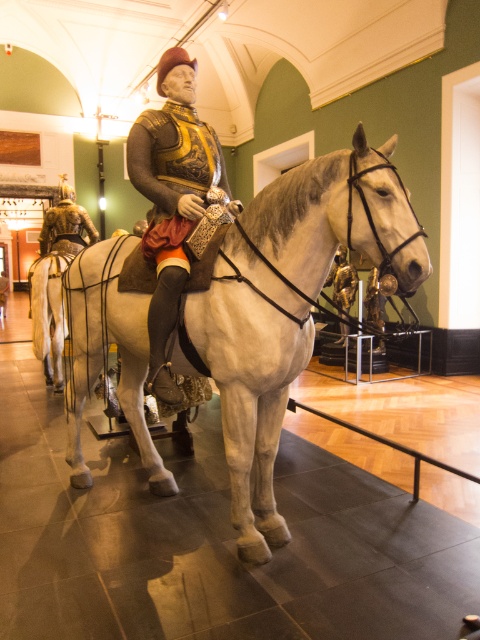
Question: Which point is farther from the camera taking this photo?

Choices:
 (A) (95, 312)
 (B) (171, 291)

Answer: (A)

Question: Observing the image, what is the correct spatial positioning of white glossy horse at center in reference to matte gold armor at center?

Choices:
 (A) above
 (B) below

Answer: (B)

Question: Is white glossy horse at center in front of matte gold armor at center?

Choices:
 (A) yes
 (B) no

Answer: (A)

Question: Is white glossy horse at center positioned behind matte gold armor at center?

Choices:
 (A) no
 (B) yes

Answer: (A)

Question: Among these points, which one is nearest to the camera?

Choices:
 (A) (396, 205)
 (B) (166, 86)

Answer: (A)